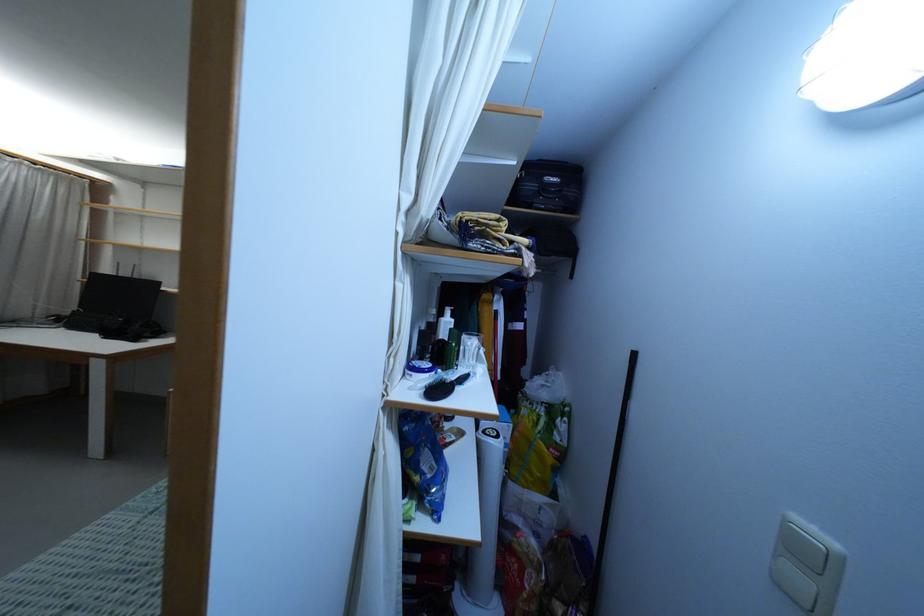
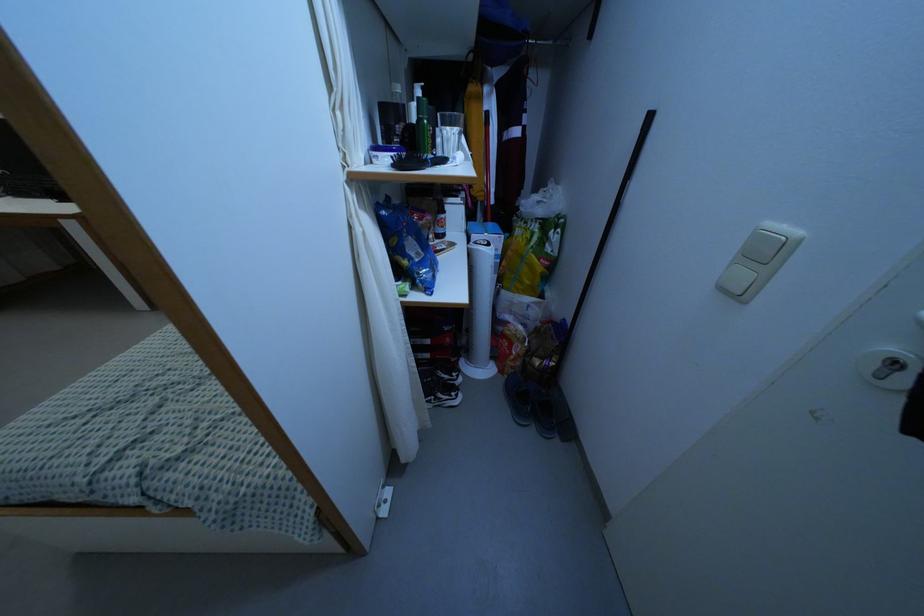
Locate, in the second image, the point that corresponds to (422,474) in the first image.

(409, 257)